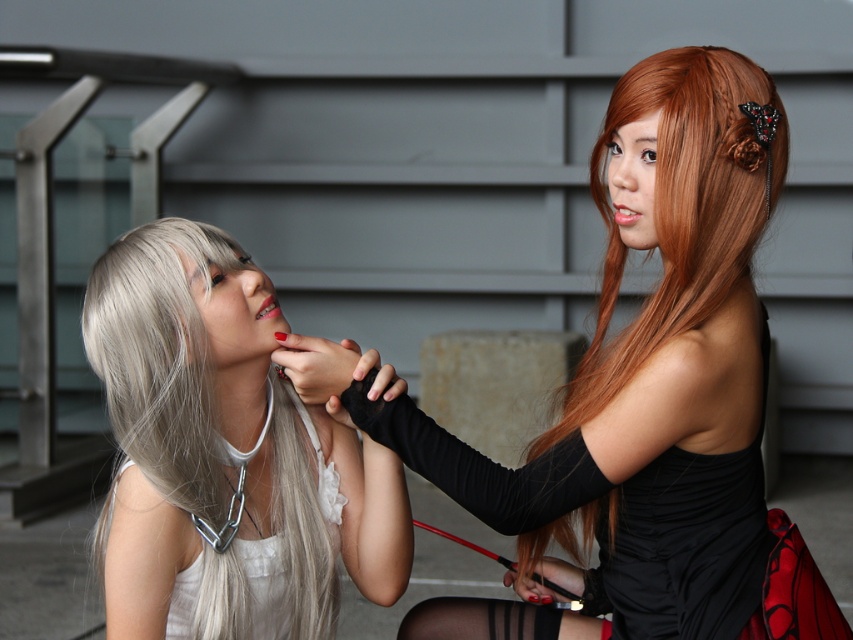
You are a photographer trying to capture a closeup of both the shiny orange hair at right and the matte red lipstick at upper right. Which object should you focus on first to ensure it appears sharp in the photo?

The shiny orange hair at right should be focused on first because it is closer to the viewer than the matte red lipstick at upper right, ensuring it stays sharp while the background element may blur slightly.

You are a photographer setting up a shoot for two models wearing the white satin dress at left and the black leather jacket at right. The models need to stand exactly 2 meters apart for the shot. Based on the scene, will their current positions meet the requirement?

The models are currently 2.05 meters apart, which is slightly more than the required 2 meters. They should move closer by 5 centimeters to meet the exact distance requirement.

You are a photographer setting up for a photoshoot. You need to ensure that the white satin dress at left and the matte red lipstick at upper right are both visible in the frame. Given their sizes, which object should you focus on first to ensure proper framing?

The white satin dress at left is taller than the matte red lipstick at upper right, so you should focus on framing the white satin dress at left first to ensure it fits within the camera frame.